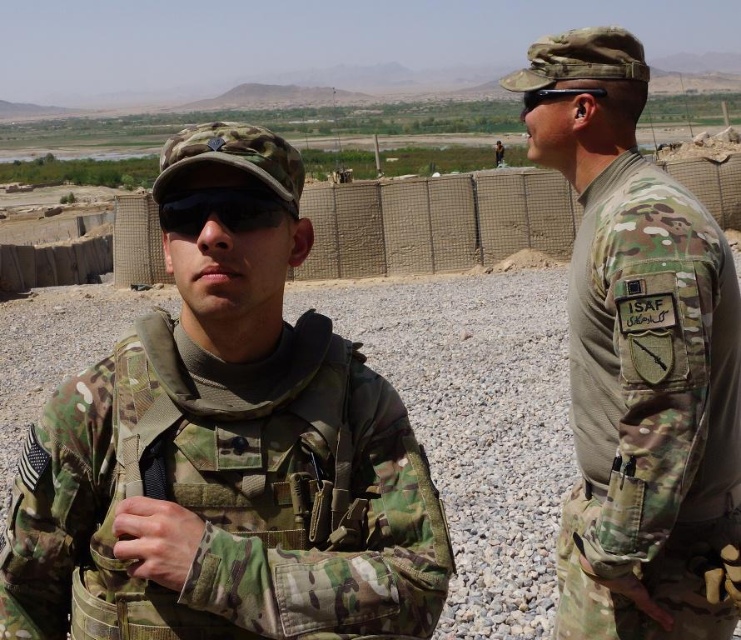
You are a photographer trying to capture a group photo of two soldiers in a desert setting. You notice that one soldier is wearing a camo uniform at center and another is wearing a camouflage uniform at center. Which soldier is standing to the left of the other?

The camo uniform at center is positioned on the left side of the camouflage uniform at center, so the soldier in the camo uniform at center is standing to the left of the soldier in the camouflage uniform at center.